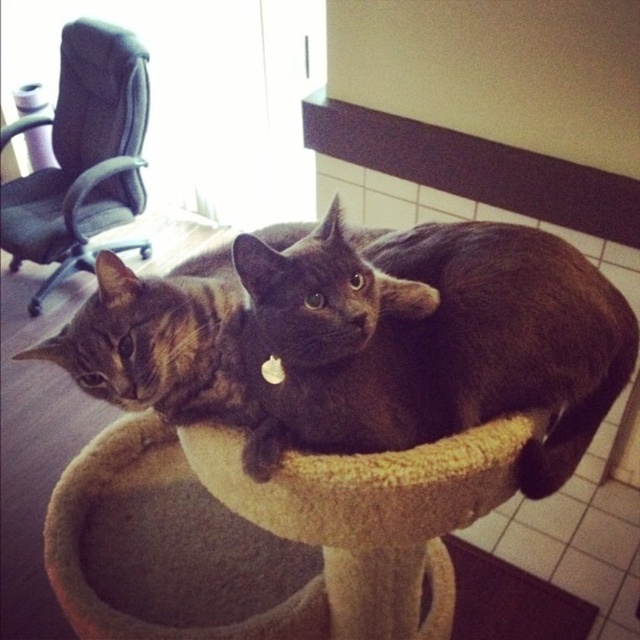
Question: Based on their relative distances, which object is nearer to the shiny black cat at center?

Choices:
 (A) beige carpeted cat bed at center
 (B) tabby fur cat at center
 (C) black fabric swivel chair at left

Answer: (A)

Question: Can you confirm if beige carpeted cat bed at center is positioned to the right of tabby fur cat at center?

Choices:
 (A) yes
 (B) no

Answer: (A)

Question: Which object is farther from the camera taking this photo?

Choices:
 (A) black fabric swivel chair at left
 (B) beige carpeted cat bed at center

Answer: (A)

Question: Which object is positioned closest to the black fabric swivel chair at left?

Choices:
 (A) tabby fur cat at center
 (B) beige carpeted cat bed at center
 (C) shiny black cat at center

Answer: (B)

Question: Does beige carpeted cat bed at center have a greater width compared to tabby fur cat at center?

Choices:
 (A) no
 (B) yes

Answer: (B)

Question: Does shiny black cat at center have a larger size compared to tabby fur cat at center?

Choices:
 (A) yes
 (B) no

Answer: (A)